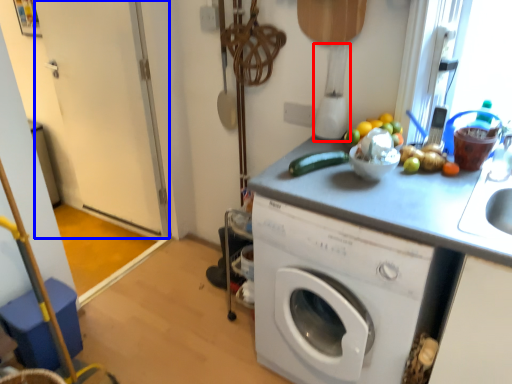
Question: Which object is closer to the camera taking this photo, blender (highlighted by a red box) or screen door (highlighted by a blue box)?

Choices:
 (A) blender
 (B) screen door

Answer: (A)